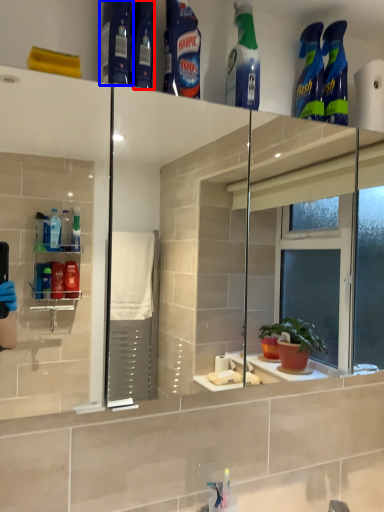
Question: Which of the following is the farthest to the observer, toiletry (highlighted by a red box) or cleaning product (highlighted by a blue box)?

Choices:
 (A) toiletry
 (B) cleaning product

Answer: (A)